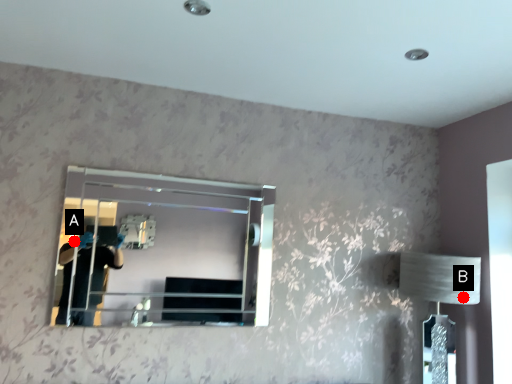
Question: Two points are circled on the image, labeled by A and B beside each circle. Which of the following is the farthest from the observer?

Choices:
 (A) A is further
 (B) B is further

Answer: (B)